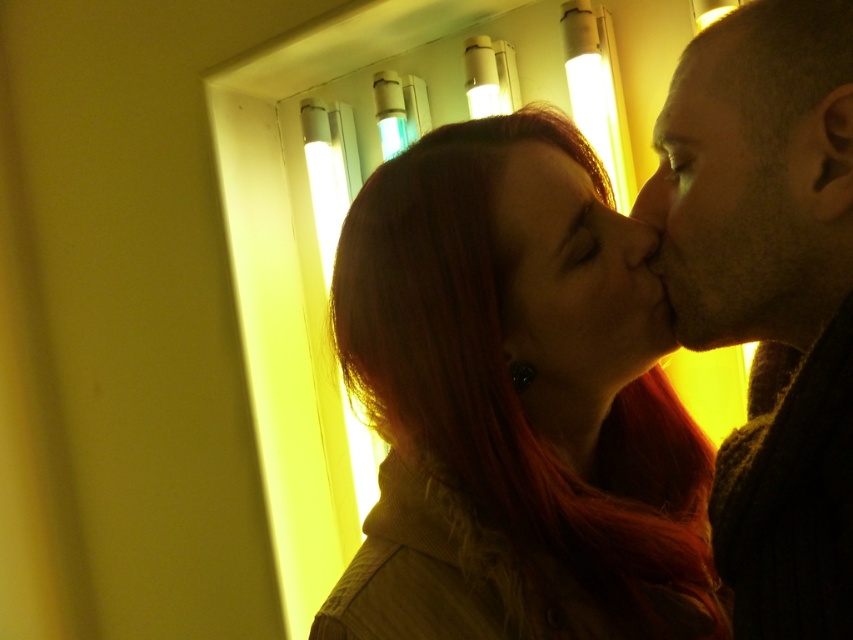
Question: Considering the real-world distances, which object is closest to the shiny red hair at center?

Choices:
 (A) matte skin nose at right
 (B) dark brown hair at right
 (C) matte red hair at center

Answer: (C)

Question: Can you confirm if shiny red hair at center is wider than dark brown hair at right?

Choices:
 (A) no
 (B) yes

Answer: (B)

Question: Is matte red hair at center to the right of matte skin nose at center from the viewer's perspective?

Choices:
 (A) no
 (B) yes

Answer: (A)

Question: Which object appears closest to the camera in this image?

Choices:
 (A) smooth skin face at right
 (B) matte skin nose at center
 (C) matte skin nose at right

Answer: (A)

Question: Is dark brown hair at right closer to the viewer compared to matte skin nose at right?

Choices:
 (A) no
 (B) yes

Answer: (B)

Question: Among these points, which one is farthest from the camera?

Choices:
 (A) tap(543, 394)
 (B) tap(461, 381)
 (C) tap(651, 179)

Answer: (A)